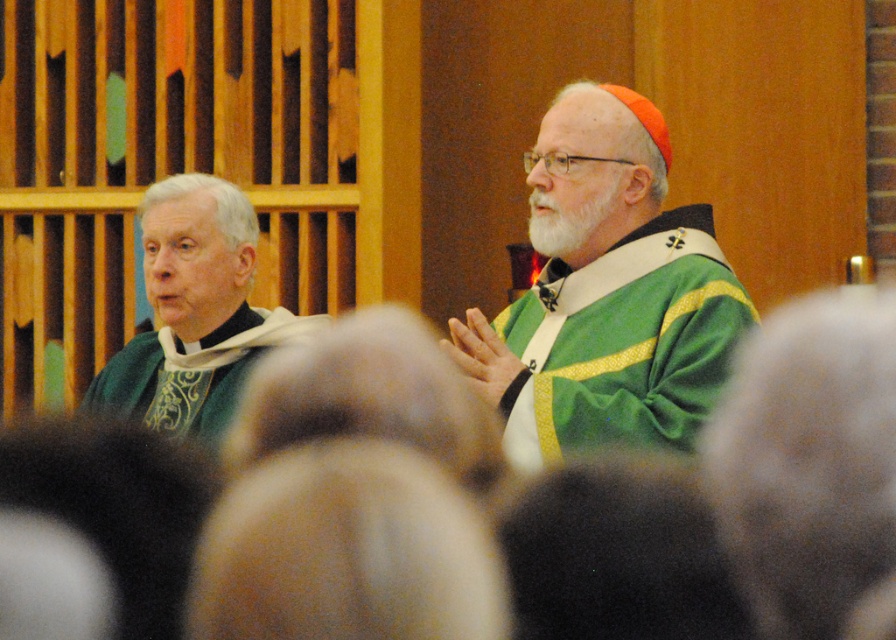
You are a tailor measuring garments for two priests in a church. You need to determine which garment requires more fabric for the sleeves. Which one is wider between the green velvet robe at center and the green velvet vestment at left?

The green velvet robe at center is wider than the green velvet vestment at left, so it requires more fabric for the sleeves.

You are a photographer standing in front of the two religious figures in the church. You need to take a photo that includes both the green velvet robe at center and the green velvet vestment at left. Based on their positions, which one should you focus on first to ensure both are in frame?

The green velvet robe at center is to the right of the green velvet vestment at left. Since the robe is positioned to the right of the vestment, you should focus on the green velvet vestment at left first to ensure both are included in the frame.